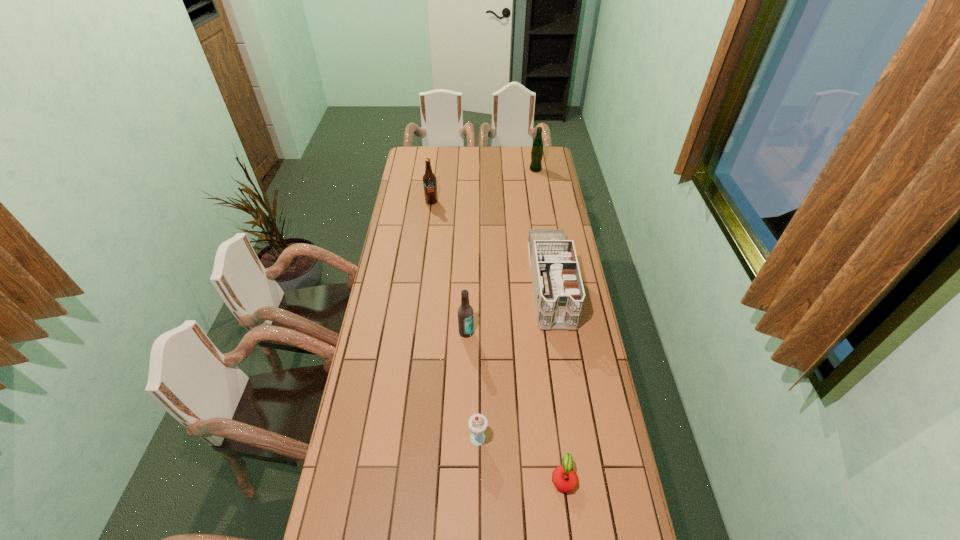
Where is `object present at the far right corner`? object present at the far right corner is located at coordinates (537, 147).

What are the coordinates of `vacant space at the far edge of the desktop` in the screenshot? It's located at (516, 150).

In the image, there is a desktop. Identify the location of vacant space at the left edge. This screenshot has height=540, width=960. tap(412, 213).

Image resolution: width=960 pixels, height=540 pixels. What are the coordinates of `blank space at the right edge of the desktop` in the screenshot? It's located at (529, 170).

In order to click on empty space between the milkshake and the nearest object in this screenshot , I will do `click(520, 456)`.

Image resolution: width=960 pixels, height=540 pixels. What are the coordinates of `free space between the second nearest beer bottle and the milkshake` in the screenshot? It's located at (455, 318).

Locate an element on the screen. The image size is (960, 540). blank region between the farthest object and the dollhouse is located at coordinates (542, 227).

Locate an element on the screen. vacant area that lies between the second beer bottle from left to right and the fifth nearest object is located at coordinates (449, 267).

Locate an element on the screen. This screenshot has width=960, height=540. vacant area that lies between the dollhouse and the fifth farthest object is located at coordinates (515, 359).

In order to click on free spot between the leftmost beer bottle and the milkshake in this screenshot , I will do `click(455, 318)`.